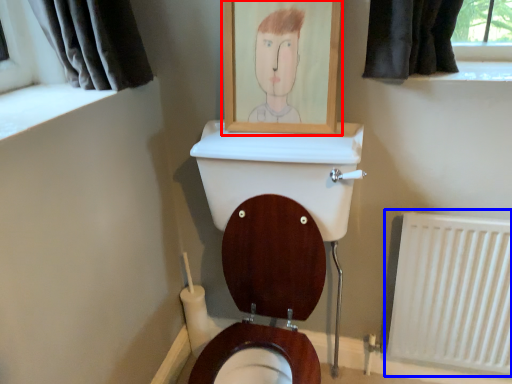
Question: Which point is further to the camera, picture frame (highlighted by a red box) or radiator (highlighted by a blue box)?

Choices:
 (A) picture frame
 (B) radiator

Answer: (B)